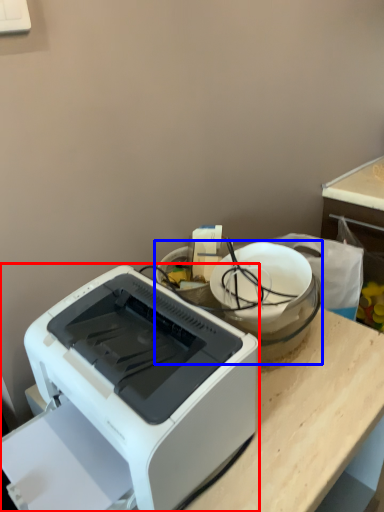
Question: Which object is further to the camera taking this photo, printer (highlighted by a red box) or appliance (highlighted by a blue box)?

Choices:
 (A) printer
 (B) appliance

Answer: (B)